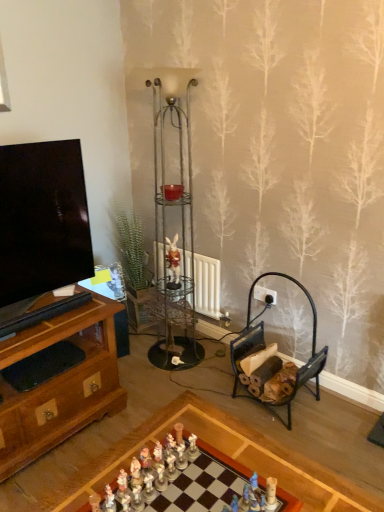
Locate an element on the screen. This screenshot has height=512, width=384. vacant area on the back side of matte blue figurine at center, which is counted as the third toy, starting from the left is located at coordinates (237, 464).